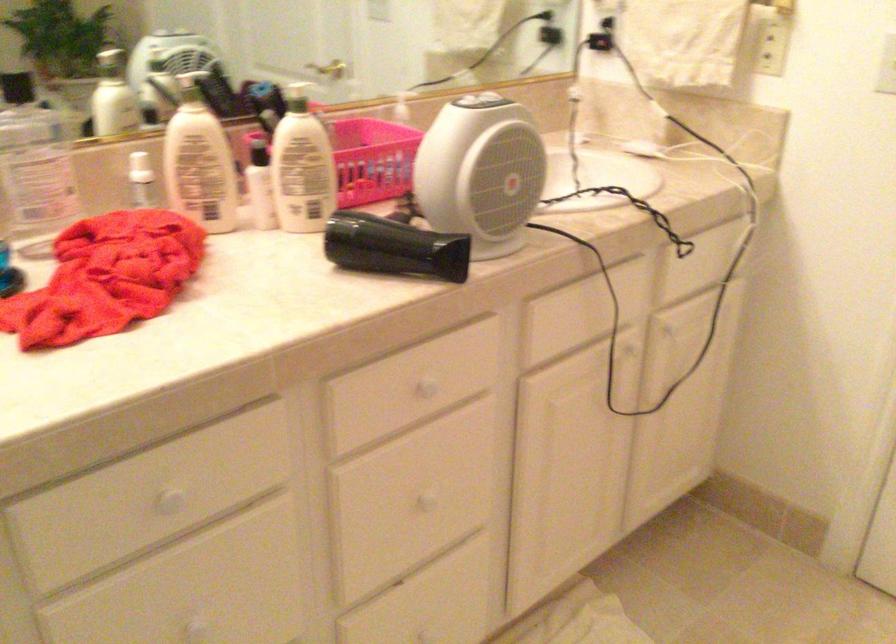
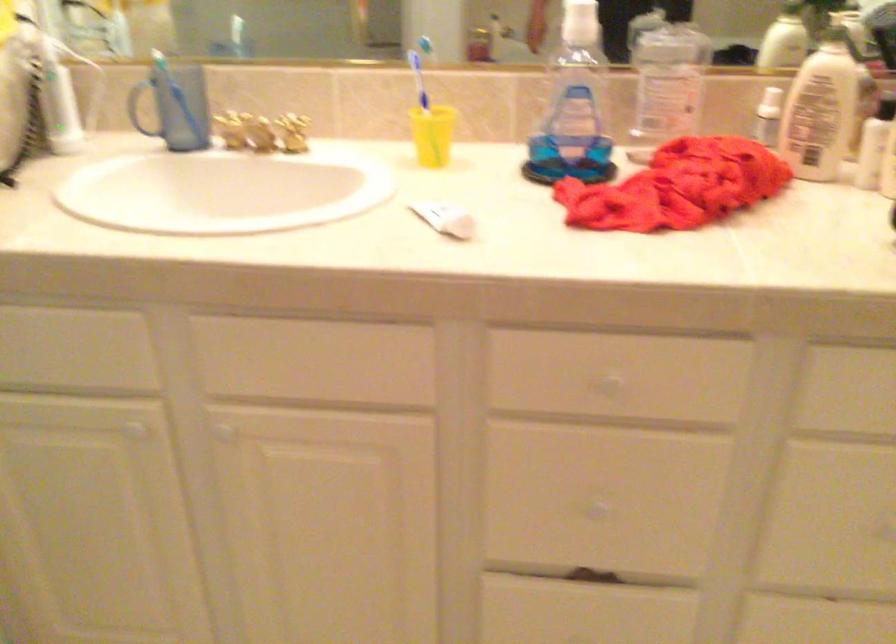
Question: The camera is either moving clockwise (left) or counter-clockwise (right) around the object. The first image is from the beginning of the video and the second image is from the end. Is the camera moving left or right when shooting the video?

Choices:
 (A) Left
 (B) Right

Answer: (B)